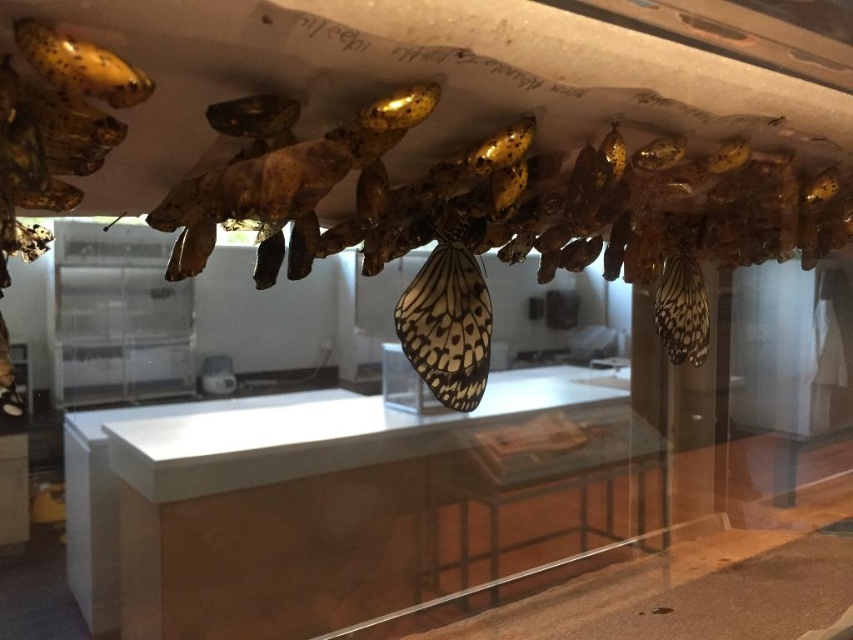
You are a visitor looking at the display case. You notice the white glossy counter top at center and the translucent white butterfly at center. Which object appears closer to you through the glass?

The white glossy counter top at center appears closer because the translucent white butterfly at center is positioned behind it.